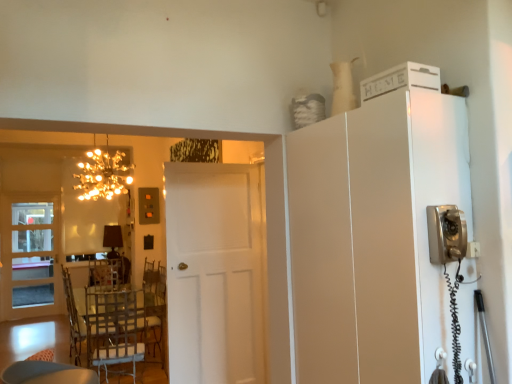
The width and height of the screenshot is (512, 384). Identify the location of empty space that is ontop of white matte door at center, placed as the second door when sorted from back to front (from a real-world perspective). (213, 164).